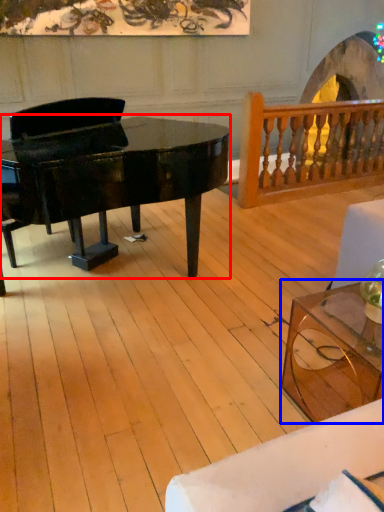
Question: Which point is closer to the camera, piano (highlighted by a red box) or coffee table (highlighted by a blue box)?

Choices:
 (A) piano
 (B) coffee table

Answer: (B)